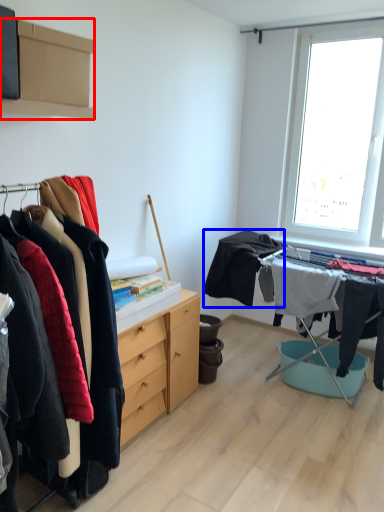
Question: Which object appears farthest to the camera in this image, cabinetry (highlighted by a red box) or clothing (highlighted by a blue box)?

Choices:
 (A) cabinetry
 (B) clothing

Answer: (B)